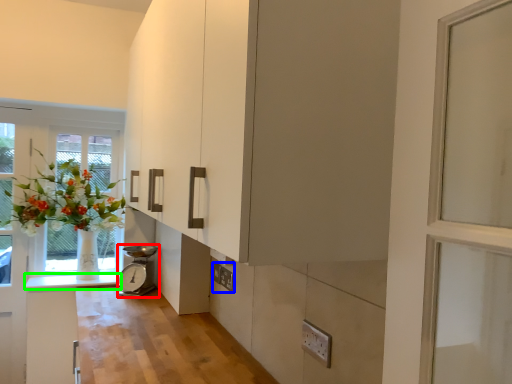
Question: Which object is positioned farthest from appliance (highlighted by a red box)? Select from electric outlet (highlighted by a blue box) and counter top (highlighted by a green box).

Choices:
 (A) electric outlet
 (B) counter top

Answer: (A)